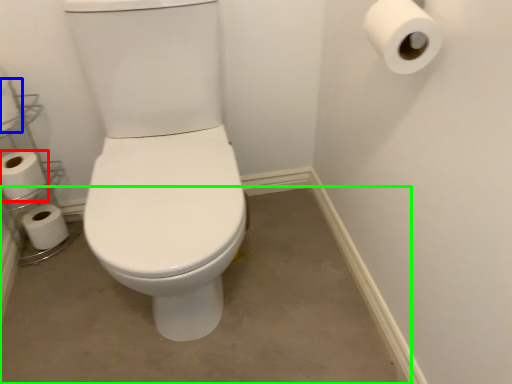
Question: Estimate the real-world distances between objects in this image. Which object is farther from toilet paper (highlighted by a red box), toilet paper (highlighted by a blue box) or concrete (highlighted by a green box)?

Choices:
 (A) toilet paper
 (B) concrete

Answer: (B)